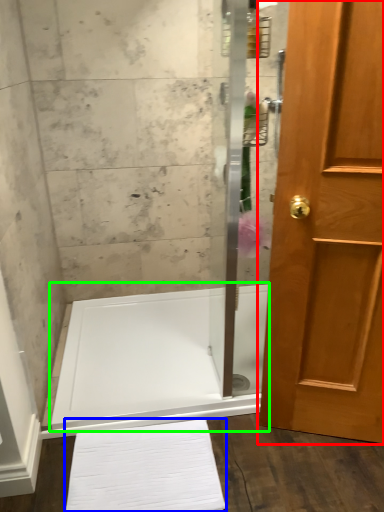
Question: Which object is the closest to the door (highlighted by a red box)? Choose among these: bath towel (highlighted by a blue box) or bath (highlighted by a green box).

Choices:
 (A) bath towel
 (B) bath

Answer: (A)